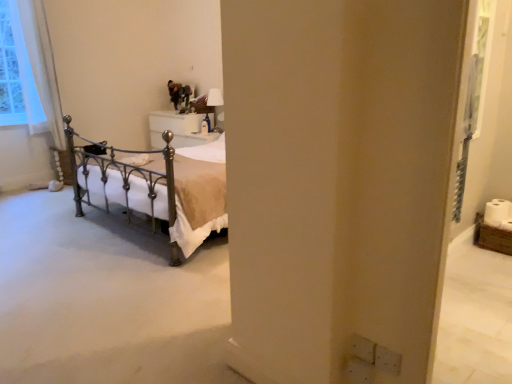
Question: Does point (206, 102) appear closer or farther from the camera than point (27, 110)?

Choices:
 (A) closer
 (B) farther

Answer: (B)

Question: In terms of width, does white glossy lampshade at upper center look wider or thinner when compared to white sheer curtain at left?

Choices:
 (A) thin
 (B) wide

Answer: (A)

Question: Which is farther from the white glossy nightstand at center?

Choices:
 (A) white glossy lampshade at upper center
 (B) white sheer curtain at left

Answer: (B)

Question: Which object is the farthest from the white glossy nightstand at center?

Choices:
 (A) white glossy lampshade at upper center
 (B) white sheer curtain at left

Answer: (B)